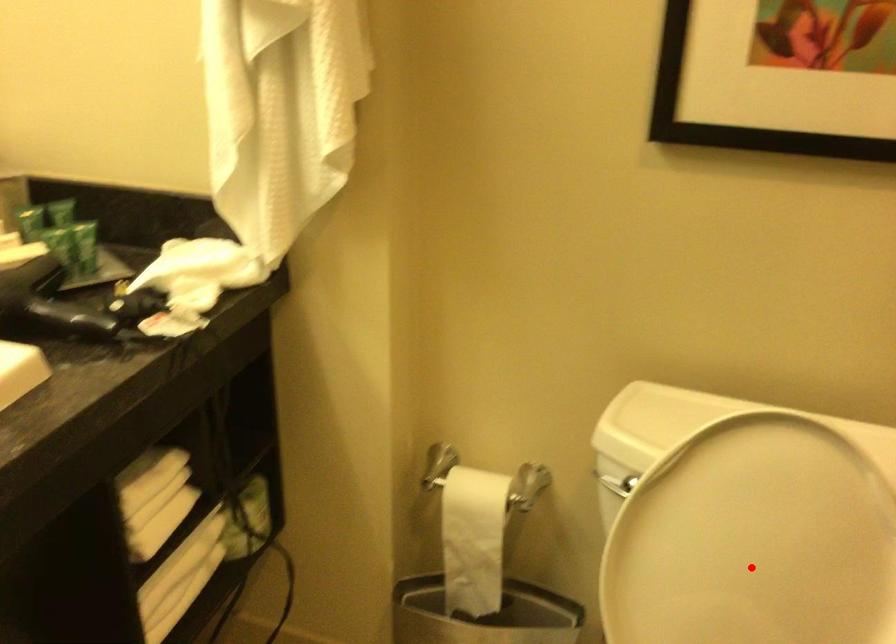
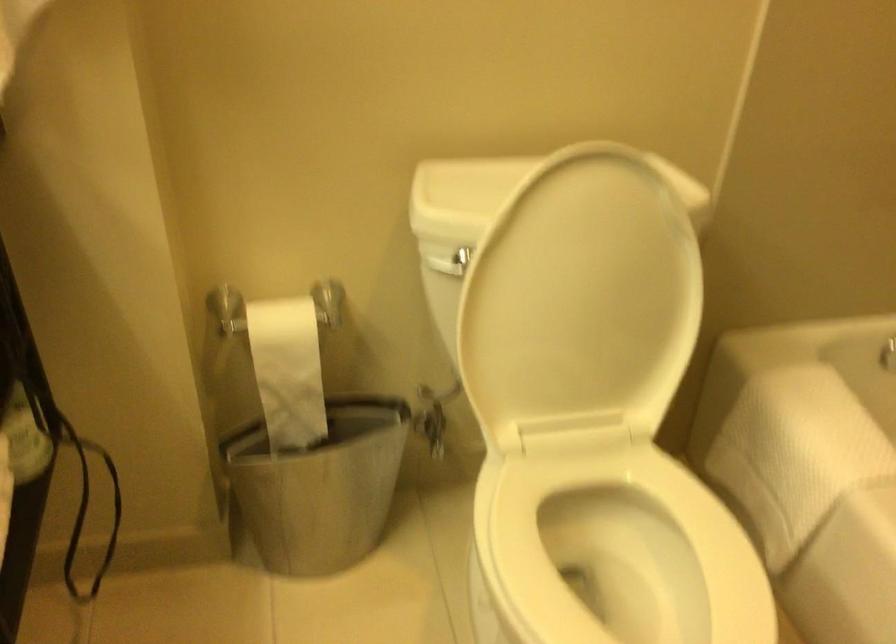
The point at the highlighted location is marked in the first image. Where is the corresponding point in the second image?

(581, 301)